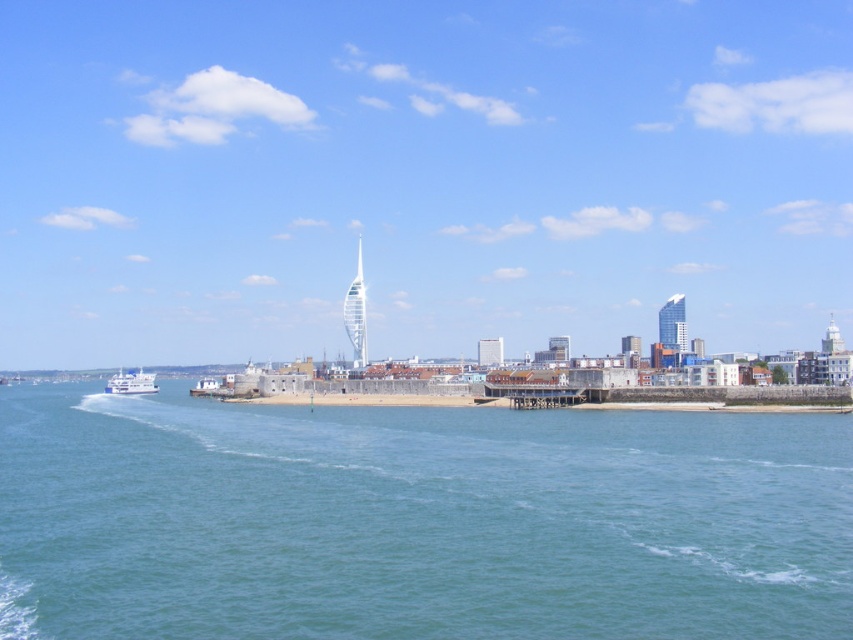
Consider the image. Does transparent glass skyline at center come in front of clear blue water at lower center?

No.

Can you confirm if transparent glass skyline at center is positioned to the right of clear blue water at lower center?

In fact, transparent glass skyline at center is to the left of clear blue water at lower center.

The width and height of the screenshot is (853, 640). I want to click on transparent glass skyline at center, so click(418, 176).

Based on the photo, which of these two, transparent glass skyline at center or white glossy ferry at lower left, stands taller?

transparent glass skyline at center

Is point (200, 244) positioned behind point (114, 376)?

Yes, point (200, 244) is farther from viewer.

Where is `transparent glass skyline at center`? The image size is (853, 640). transparent glass skyline at center is located at coordinates (418, 176).

Is the position of clear blue water at lower center less distant than that of white glossy ferry at lower left?

That is True.

Is clear blue water at lower center smaller than white glossy ferry at lower left?

Incorrect, clear blue water at lower center is not smaller in size than white glossy ferry at lower left.

Does point (212, 536) lie in front of point (112, 380)?

Yes, it is.

Find the location of `clear blue water at lower center`. clear blue water at lower center is located at coordinates (416, 520).